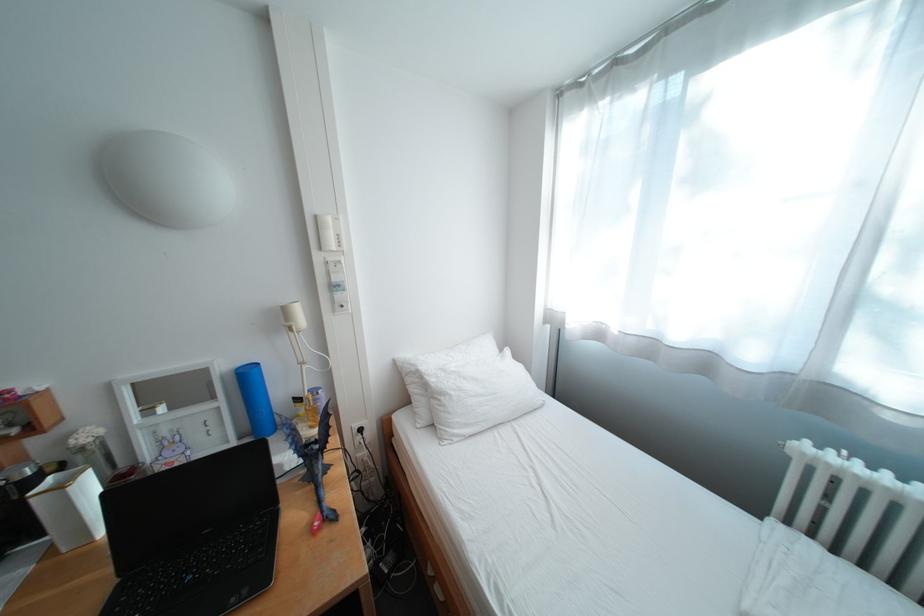
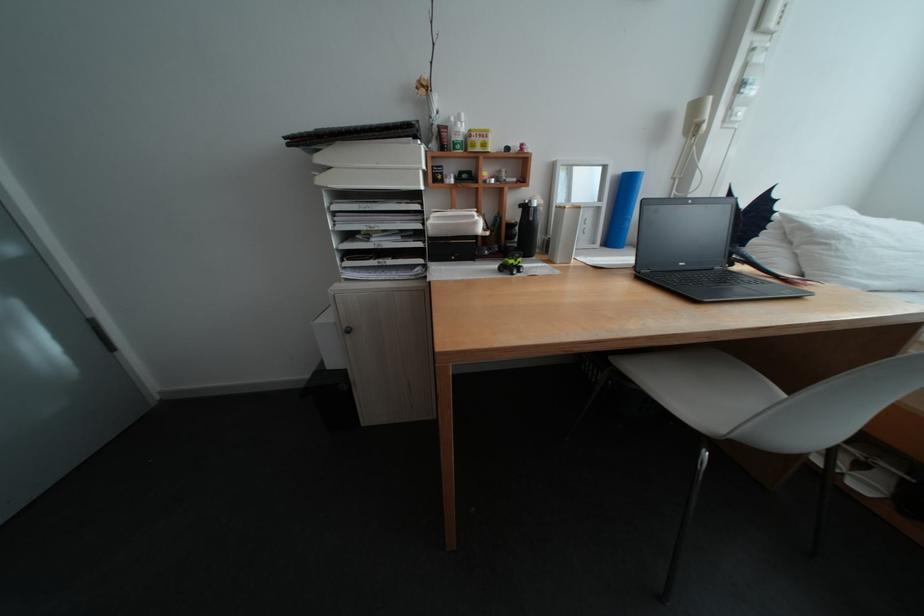
In the second image, find the point that corresponds to point 216,533 in the first image.

(694, 265)